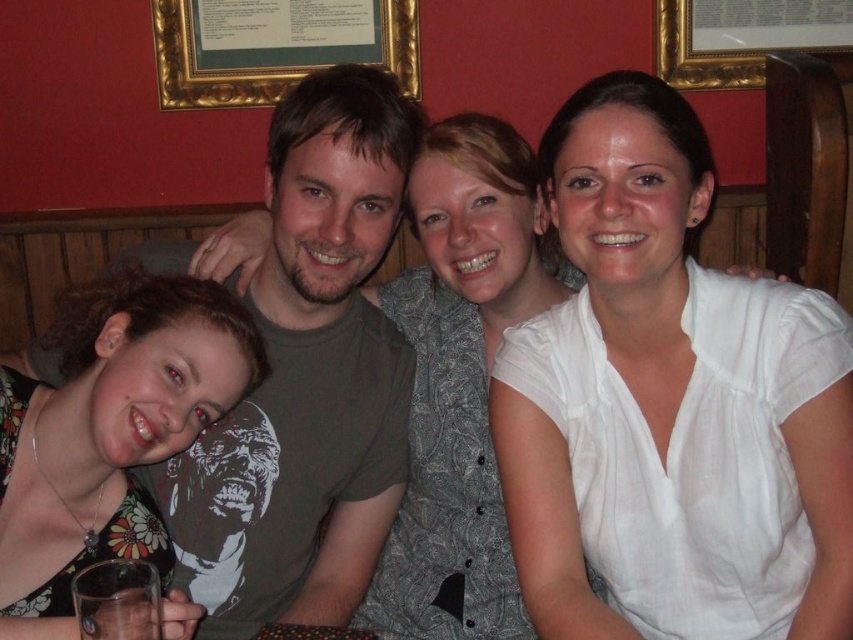
Question: Can you confirm if white cotton blouse at center is positioned to the right of clear glass at lower left?

Choices:
 (A) yes
 (B) no

Answer: (A)

Question: Based on their relative distances, which object is nearer to the white cotton blouse at center?

Choices:
 (A) gold-framed picture at upper center
 (B) matte green t-shirt at center
 (C) gold framed picture at upper center
 (D) clear glass at lower left

Answer: (B)

Question: Is white cotton blouse at center in front of gold-framed picture at upper center?

Choices:
 (A) no
 (B) yes

Answer: (B)

Question: Does matte green t-shirt at center appear under clear glass at lower left?

Choices:
 (A) yes
 (B) no

Answer: (B)

Question: Which point is closer to the camera?

Choices:
 (A) gold framed picture at upper center
 (B) clear glass at lower left
 (C) floral print dress at lower left

Answer: (B)

Question: Which point is closer to the camera taking this photo?

Choices:
 (A) (141, 636)
 (B) (701, 6)
 (C) (392, 45)

Answer: (A)